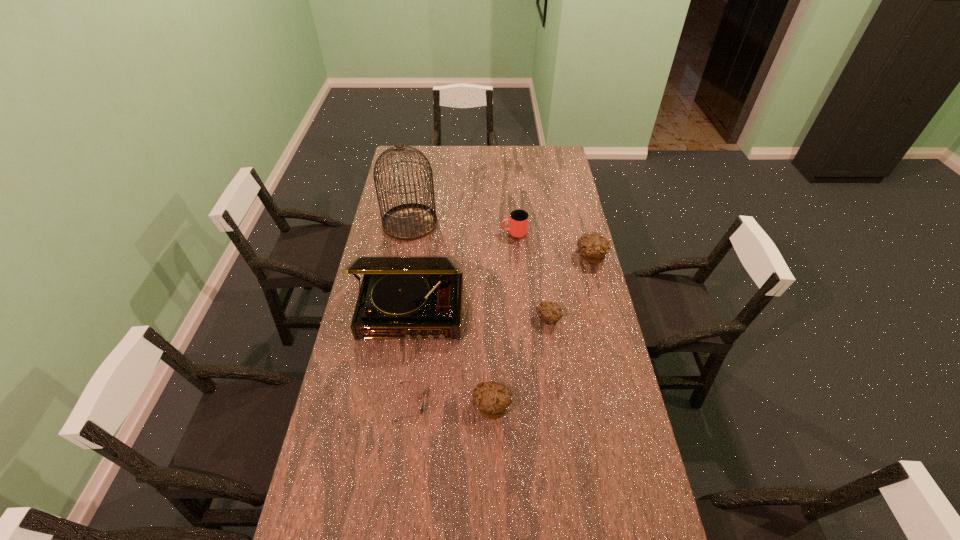
Find the location of `record player that is at the left edge`. record player that is at the left edge is located at coordinates (x=401, y=296).

In the image, there is a desktop. Where is `vacant space at the far edge`? Image resolution: width=960 pixels, height=540 pixels. vacant space at the far edge is located at coordinates (432, 150).

In the image, there is a desktop. Where is `vacant space at the left edge`? Image resolution: width=960 pixels, height=540 pixels. vacant space at the left edge is located at coordinates (380, 363).

The width and height of the screenshot is (960, 540). Identify the location of vacant region at the right edge of the desktop. (559, 237).

Image resolution: width=960 pixels, height=540 pixels. In the image, there is a desktop. Find the location of `free space at the far left corner`. free space at the far left corner is located at coordinates (419, 161).

Image resolution: width=960 pixels, height=540 pixels. Identify the location of free location at the near left corner. (325, 509).

The height and width of the screenshot is (540, 960). Find the location of `vacant region at the near right corner of the desktop`. vacant region at the near right corner of the desktop is located at coordinates (629, 516).

You are a GUI agent. You are given a task and a screenshot of the screen. Output one action in this format:
    pyautogui.click(x=<x>, y=<y>)
    Task: Click on the vacant space that is in between the second muffin from left to right and the cup
    This screenshot has width=960, height=540.
    Given the screenshot: What is the action you would take?
    pos(531,276)

Identify the location of free space between the birdcage and the second shortest object. The height and width of the screenshot is (540, 960). (479, 271).

Locate an element on the screen. Image resolution: width=960 pixels, height=540 pixels. free space that is in between the cup and the sixth tallest object is located at coordinates (531, 276).